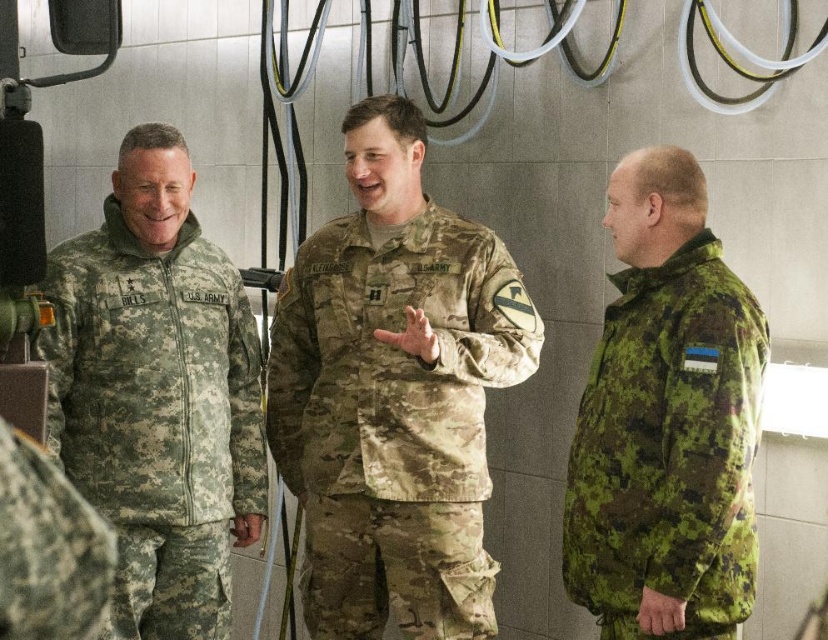
What is the location of the point with coordinates (395, 419) in the image?

The point with coordinates (395, 419) is located on the camouflage fabric uniform at center.

Looking at this image, you are a tailor measuring the space between two items in the image. You need to know if a 20 inch ruler can fully measure the distance between the camouflage fabric uniform at center and the camouflage fabric jacket at right without moving the ruler. Can it?

The distance between the camouflage fabric uniform at center and the camouflage fabric jacket at right is 20.29 inches. Since the ruler is only 20 inches long, it cannot fully measure the distance without moving.